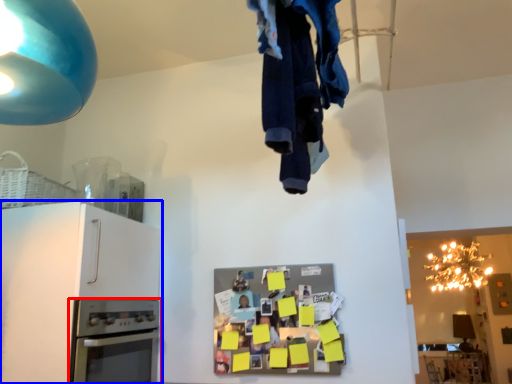
Question: Which object appears closest to the camera in this image, home appliance (highlighted by a red box) or cabinetry (highlighted by a blue box)?

Choices:
 (A) home appliance
 (B) cabinetry

Answer: (B)